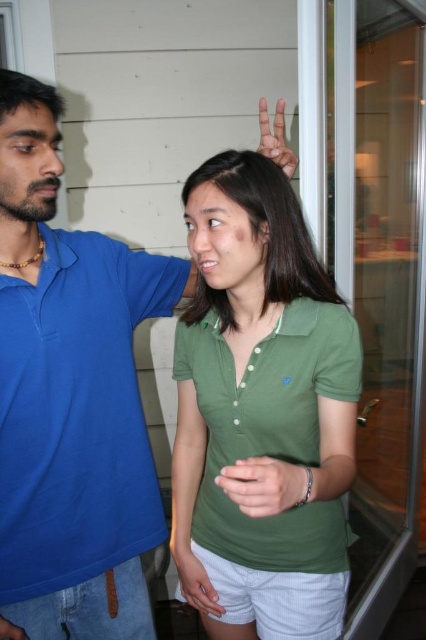
You are an interior designer assessing the layout of a room. You notice the green matte shirt at center and the matte blue hand at upper right. Which object takes up more space in the image?

The green matte shirt at center is bigger than the matte blue hand at upper right, so it takes up more space in the image.

You are a security guard checking the wristbands of attendees at an event. You notice the matte green wristband at center and the matte blue hand at upper right. Which wristband is wider?

The matte green wristband at center is wider than the matte blue hand at upper right.

You are standing in the room and want to hand a gift to the person wearing the blue cotton polo shirt at left. If you are facing the glass door, which direction should you move to reach them?

Since the blue cotton polo shirt at left is positioned at point (77, 412), you should move to your left to reach them.